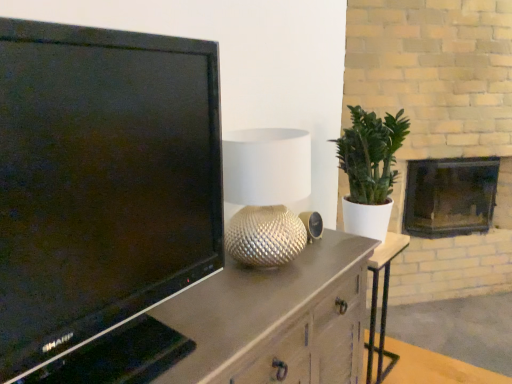
Locate an element on the screen. This screenshot has width=512, height=384. vacant space in silver textured lamp at center (from a real-world perspective) is located at coordinates (269, 272).